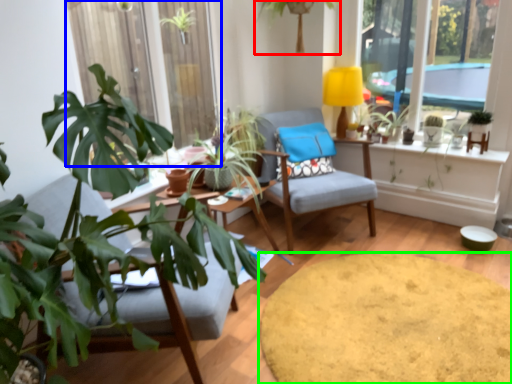
Question: Estimate the real-world distances between objects in this image. Which object is farther from houseplant (highlighted by a red box), window frame (highlighted by a blue box) or round table (highlighted by a green box)?

Choices:
 (A) window frame
 (B) round table

Answer: (B)